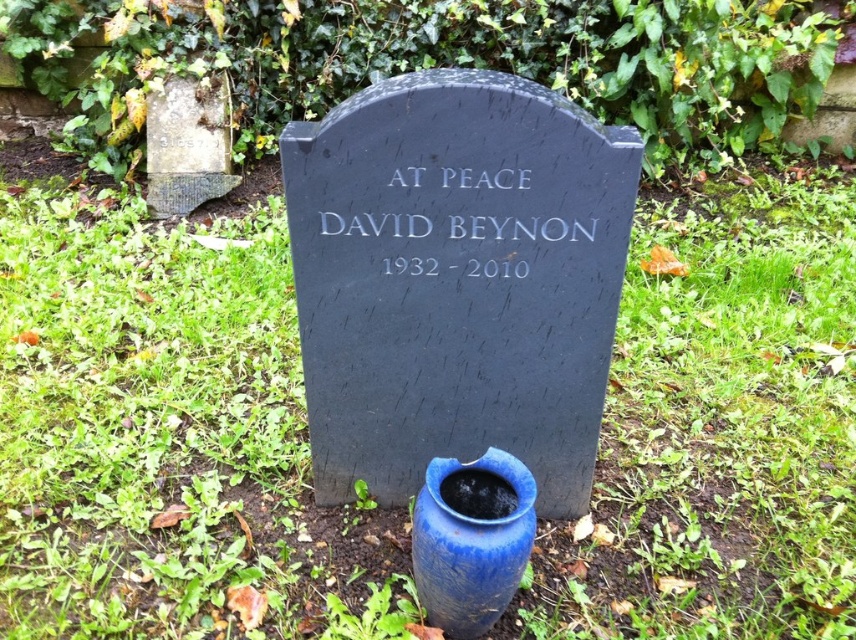
Between white metallic text at center and weathered stone gravestone at upper left, which one is positioned higher?

Positioned higher is weathered stone gravestone at upper left.

Does point (409, 273) come behind point (162, 100)?

No, (409, 273) is in front of (162, 100).

Who is more forward, (322, 227) or (212, 134)?

Positioned in front is point (322, 227).

Where is `white metallic text at center`? The image size is (856, 640). white metallic text at center is located at coordinates (456, 225).

Does blue glazed vase at center appear on the right side of weathered stone gravestone at upper left?

Correct, you'll find blue glazed vase at center to the right of weathered stone gravestone at upper left.

Which is in front, point (449, 532) or point (155, 160)?

Point (449, 532)

Find the location of a particular element. The image size is (856, 640). blue glazed vase at center is located at coordinates (470, 547).

The width and height of the screenshot is (856, 640). Find the location of `green grass at center`. green grass at center is located at coordinates (167, 438).

I want to click on green grass at center, so click(x=167, y=438).